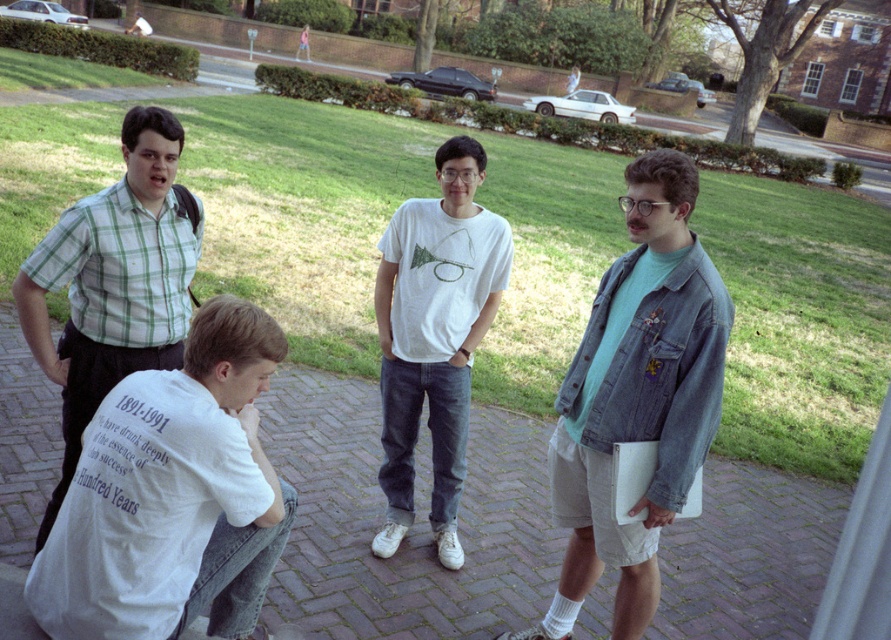
Can you confirm if white cotton t-shirt at lower left is positioned to the right of white cotton t-shirt at center?

No, white cotton t-shirt at lower left is not to the right of white cotton t-shirt at center.

Is point (256, 488) positioned behind point (409, 275)?

No, it is not.

Is point (213, 401) more distant than point (450, 401)?

No, it is in front of (450, 401).

Find the location of a particular element. white cotton t-shirt at lower left is located at coordinates (172, 496).

Describe the element at coordinates (172, 496) in the screenshot. The width and height of the screenshot is (891, 640). I see `white cotton t-shirt at lower left` at that location.

At what (x,y) coordinates should I click in order to perform the action: click on white cotton t-shirt at lower left. Please return your answer as a coordinate pair (x, y). This screenshot has width=891, height=640. Looking at the image, I should click on (172, 496).

Does brick pavement at center appear on the left side of green plaid shirt at left?

In fact, brick pavement at center is to the right of green plaid shirt at left.

Between point (405, 563) and point (103, 276), which one is positioned in front?

Positioned in front is point (103, 276).

Is point (309, 392) behind point (191, 198)?

Yes.

Find the location of a particular element. The width and height of the screenshot is (891, 640). brick pavement at center is located at coordinates (413, 525).